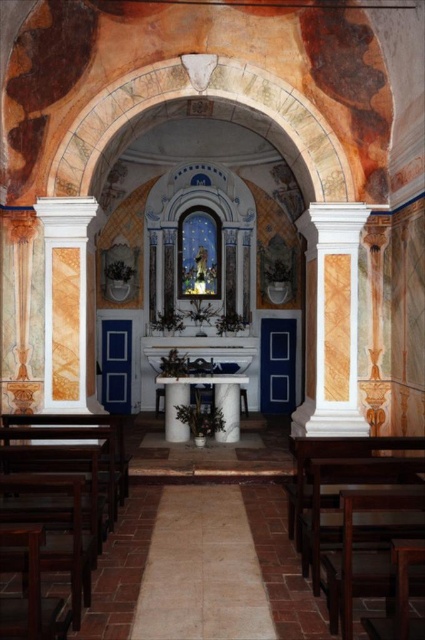
Identify the location of white marble column at right. (331, 321).

Can you confirm if white marble column at right is shorter than white marble column at left?

Incorrect, white marble column at right's height does not fall short of white marble column at left's.

Locate an element on the screen. This screenshot has height=640, width=425. white marble column at right is located at coordinates (331, 321).